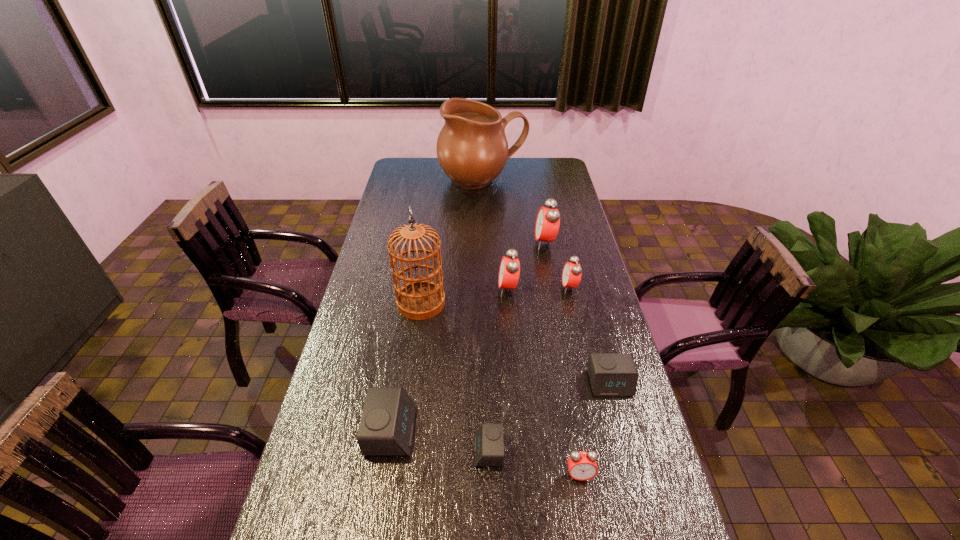
At what (x,y) coordinates should I click in order to perform the action: click on free spot located on the front-facing side of the shortest alarm clock. Please return your answer as a coordinate pair (x, y). Looking at the image, I should click on (400, 450).

You are a GUI agent. You are given a task and a screenshot of the screen. Output one action in this format:
    pyautogui.click(x=<x>, y=<y>)
    Task: Click on the vacant space situated on the front-facing side of the shortest alarm clock
    This screenshot has height=540, width=960.
    Given the screenshot: What is the action you would take?
    pyautogui.click(x=436, y=450)

Where is `object present at the far edge`? object present at the far edge is located at coordinates (472, 149).

Locate an element on the screen. The image size is (960, 540). birdcage that is at the left edge is located at coordinates (420, 299).

You are a GUI agent. You are given a task and a screenshot of the screen. Output one action in this format:
    pyautogui.click(x=<x>, y=<y>)
    Task: Click on the alarm clock that is at the left edge
    
    Given the screenshot: What is the action you would take?
    pyautogui.click(x=386, y=428)

Identify the location of free space at the left edge of the desktop. The height and width of the screenshot is (540, 960). (388, 218).

In the image, there is a desktop. Where is `free region at the right edge`? free region at the right edge is located at coordinates (572, 292).

Locate an element on the screen. The width and height of the screenshot is (960, 540). blank space at the far left corner of the desktop is located at coordinates (427, 160).

At what (x,y) coordinates should I click in order to perform the action: click on free space that is in between the fifth tallest object and the birdcage. Please return your answer as a coordinate pair (x, y). This screenshot has width=960, height=540. Looking at the image, I should click on [495, 295].

This screenshot has width=960, height=540. What are the coordinates of `vacant space that's between the leftmost black alarm clock and the second smallest red alarm clock` in the screenshot? It's located at (480, 359).